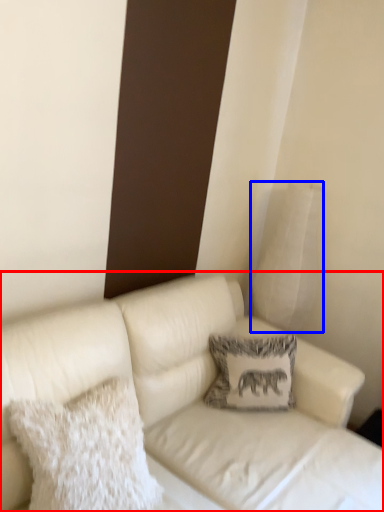
Question: Which object appears farthest to the camera in this image, studio couch (highlighted by a red box) or pillow (highlighted by a blue box)?

Choices:
 (A) studio couch
 (B) pillow

Answer: (B)